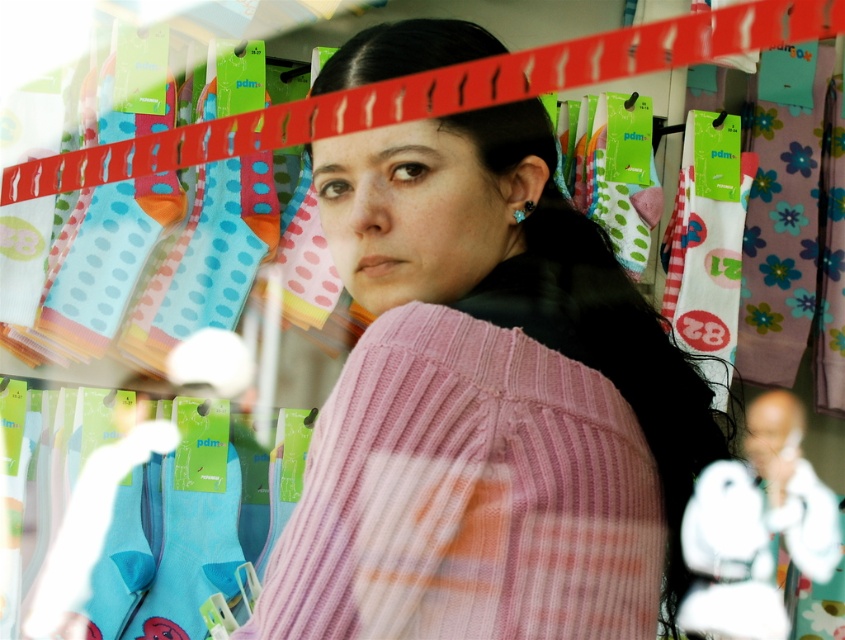
You are a customer in the store and want to reach a point that is 25.56 inches away from you. Can you confirm if the point at coordinates point (611, 628) is the one you need to reach?

The point at coordinates point (611, 628) is 25.56 inches away from the viewer, so yes, this is the point you need to reach.

You are a customer in the store and want to find the pink ribbed sweater at center. Based on the coordinates provided, where should you look in the image?

The pink ribbed sweater at center is located at point (488, 401), which corresponds to the central area of the image.

From the picture: You are a customer in the store and want to touch both the point at location point (508,372) and the point at location point (736,540). Which point would you reach first?

You would reach point (508,372) first because it is closer to you than point (736,540).